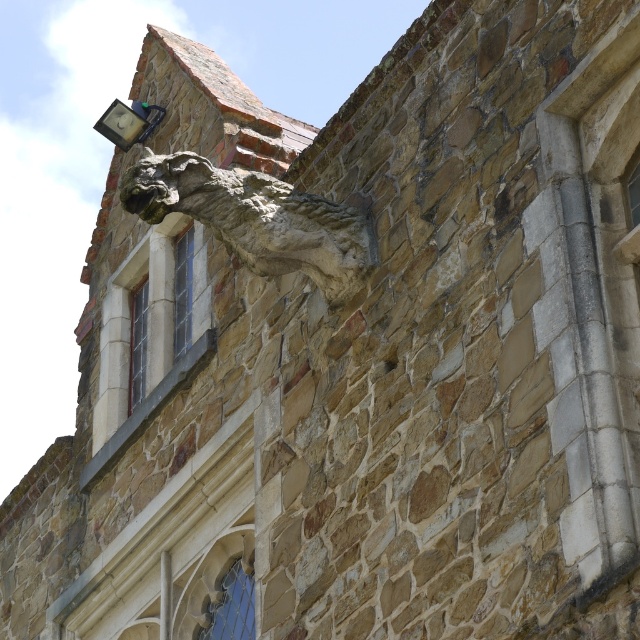
You are an architect assessing the structural integrity of the stone building. You need to determine if the metallic stone gargoyle at upper left could potentially block the clear glass window at upper center when viewed from below. Based on their relative widths, what is your assessment?

The metallic stone gargoyle at upper left might be wider than the clear glass window at upper center, so there is a possibility that it could block the window when viewed from below.

Based on the photo, you are standing in front of the stone building and want to look through the clear glass window at lower center. Based on the coordinates provided in the description, can you determine if the window is positioned high or low relative to your eye level?

The clear glass window at lower center is located at point 0.950 on the x axis and 0.362 on the y axis. Since the y coordinate is 0.362, which is closer to the bottom of the image, the window is positioned low relative to your eye level.